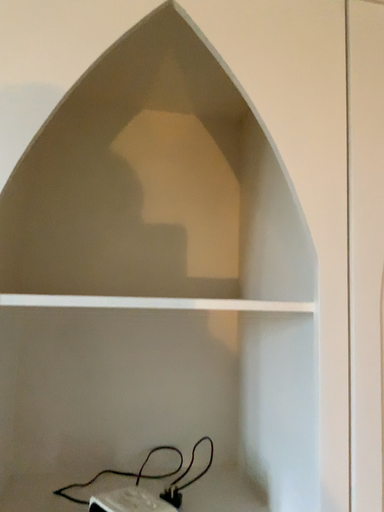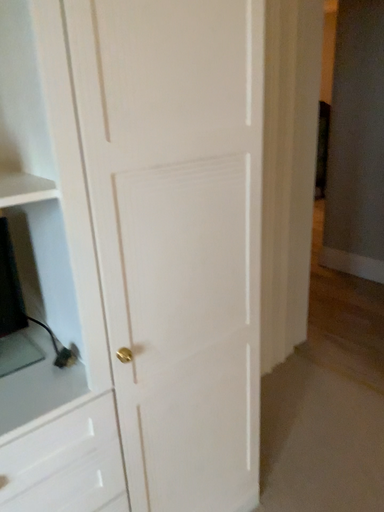
Question: Which way did the camera rotate in the video?

Choices:
 (A) rotated upward
 (B) rotated downward

Answer: (B)